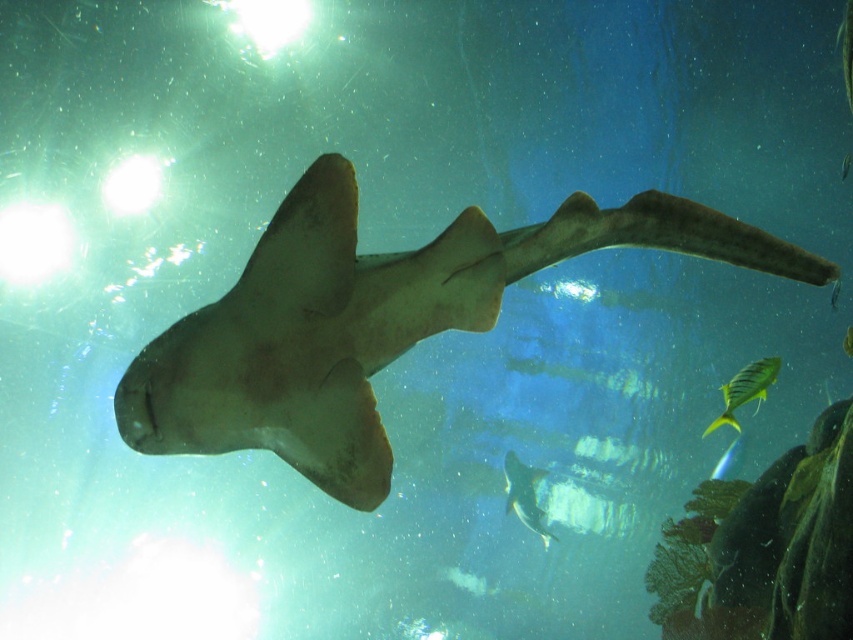
Question: Based on their relative distances, which object is nearer to the yellow-green striped fish at lower right?

Choices:
 (A) smooth tan shark at center
 (B) shiny silver fish at center

Answer: (A)

Question: Can you confirm if smooth tan shark at center is thinner than shiny silver fish at center?

Choices:
 (A) yes
 (B) no

Answer: (B)

Question: Which point is closer to the camera taking this photo?

Choices:
 (A) (535, 483)
 (B) (726, 404)
 (C) (218, 403)

Answer: (C)

Question: Which of the following is the closest to the observer?

Choices:
 (A) smooth tan shark at center
 (B) yellow-green striped fish at lower right

Answer: (A)

Question: Can you confirm if smooth tan shark at center is positioned to the left of shiny silver fish at center?

Choices:
 (A) no
 (B) yes

Answer: (B)

Question: Is smooth tan shark at center thinner than shiny silver fish at center?

Choices:
 (A) yes
 (B) no

Answer: (B)